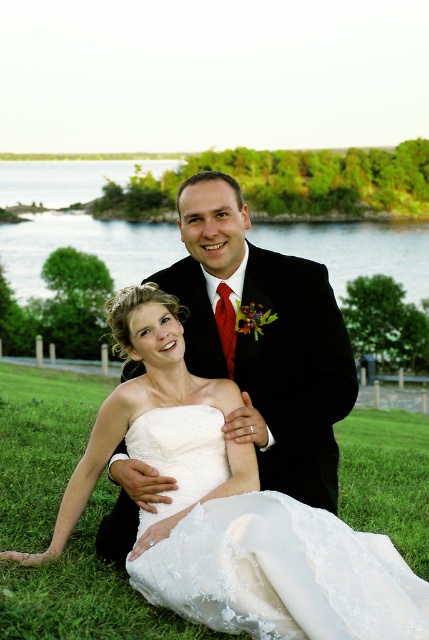
Question: Which point is closer to the camera?

Choices:
 (A) (334, 611)
 (B) (163, 376)
 (C) (235, 266)

Answer: (A)

Question: Does white satin dress at center appear over black satin suit at center?

Choices:
 (A) yes
 (B) no

Answer: (B)

Question: Is white satin dress at center bigger than white lace dress at lower center?

Choices:
 (A) yes
 (B) no

Answer: (A)

Question: Estimate the real-world distances between objects in this image. Which object is farther from the white satin dress at center?

Choices:
 (A) white lace dress at lower center
 (B) black satin suit at center

Answer: (B)

Question: Estimate the real-world distances between objects in this image. Which object is farther from the black satin suit at center?

Choices:
 (A) white lace dress at lower center
 (B) white satin dress at center

Answer: (A)

Question: Is black satin suit at center wider than white lace dress at lower center?

Choices:
 (A) no
 (B) yes

Answer: (A)